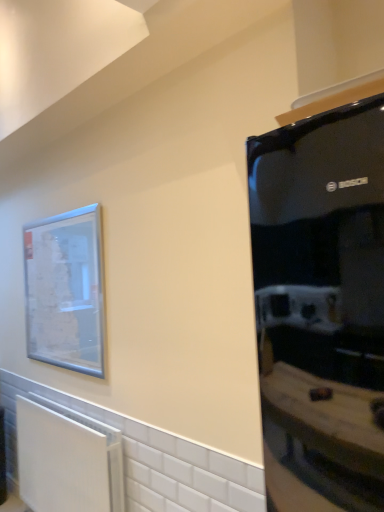
Locate an element on the screen. This screenshot has height=512, width=384. free region under clear glass picture frame at upper left (from a real-world perspective) is located at coordinates (67, 387).